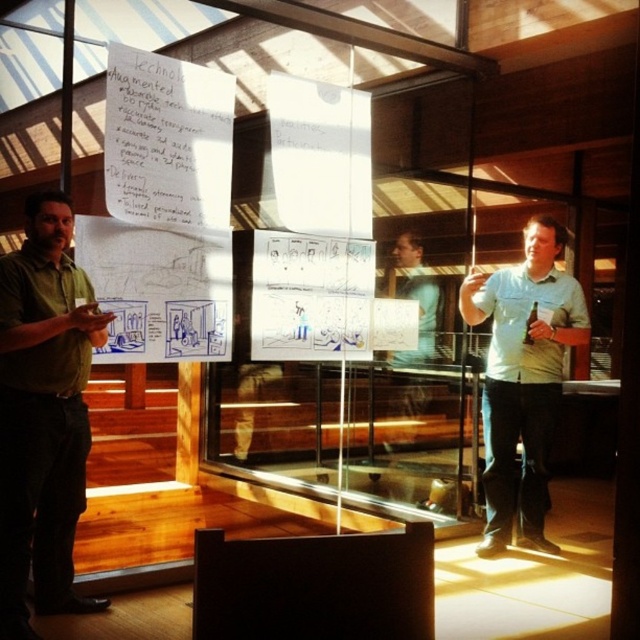
Question: Does green matte shirt at left appear under white shirt at right?

Choices:
 (A) no
 (B) yes

Answer: (B)

Question: Which of the following is the closest to the observer?

Choices:
 (A) white shirt at right
 (B) green matte shirt at left

Answer: (B)

Question: Among these points, which one is farthest from the camera?

Choices:
 (A) (44, 330)
 (B) (488, 497)

Answer: (B)

Question: Which point is closer to the camera?

Choices:
 (A) white shirt at right
 (B) green matte shirt at left

Answer: (B)

Question: Is green matte shirt at left above white shirt at right?

Choices:
 (A) yes
 (B) no

Answer: (B)

Question: Does green matte shirt at left appear on the left side of white shirt at right?

Choices:
 (A) yes
 (B) no

Answer: (A)